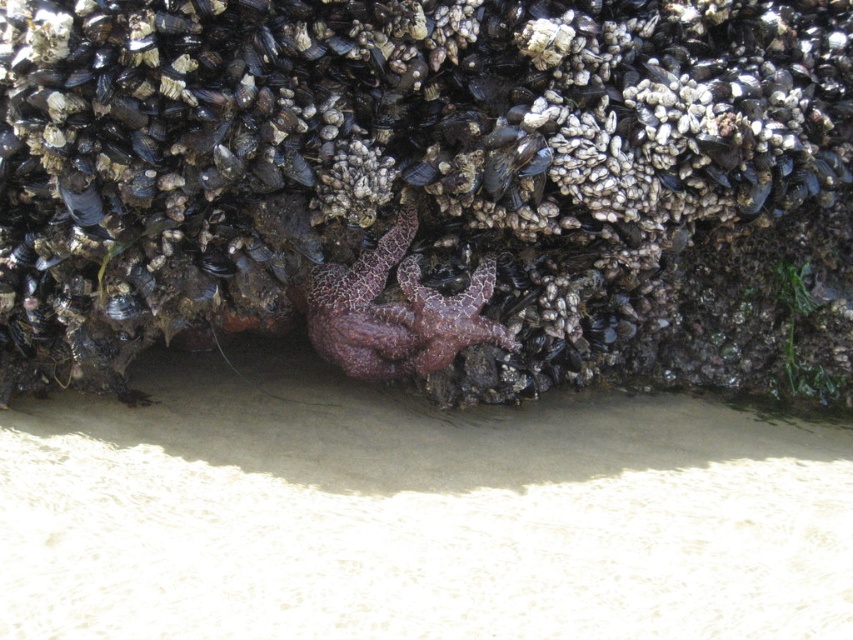
Which is more to the right, smooth dark shells at center or purple coral at center?

smooth dark shells at center

Between smooth dark shells at center and purple coral at center, which one is positioned lower?

purple coral at center is lower down.

The height and width of the screenshot is (640, 853). What do you see at coordinates (433, 186) in the screenshot? I see `smooth dark shells at center` at bounding box center [433, 186].

Locate an element on the screen. The height and width of the screenshot is (640, 853). smooth dark shells at center is located at coordinates (433, 186).

Is point (399, 326) behind point (408, 320)?

Yes, point (399, 326) is farther from viewer.

Does point (486, 285) come closer to viewer compared to point (434, 369)?

Yes, point (486, 285) is closer to viewer.

In order to click on purple rough starfish at center in this screenshot , I will do `click(396, 310)`.

Which is more to the left, purple coral at center or purple matte starfish at center?

From the viewer's perspective, purple coral at center appears more on the left side.

Does point (195, 444) lie behind point (438, 321)?

No, it is not.

Where is `purple coral at center`? purple coral at center is located at coordinates (413, 513).